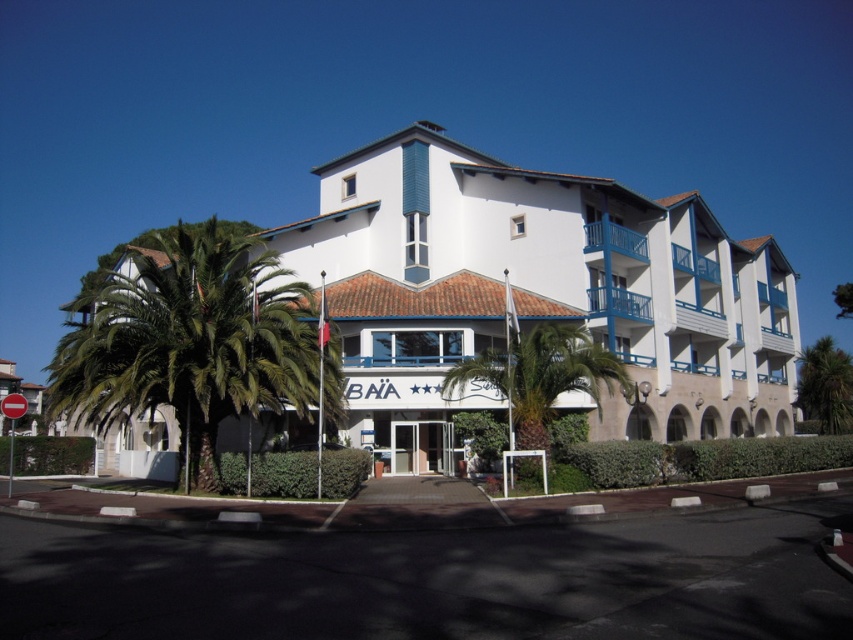
Question: Which point appears farthest from the camera in this image?

Choices:
 (A) [837, 416]
 (B) [532, 413]
 (C) [659, 417]

Answer: (A)

Question: Is green leafy palm tree at left to the left of green leafy palm tree at right from the viewer's perspective?

Choices:
 (A) no
 (B) yes

Answer: (B)

Question: Does green leafy palm tree at left appear over green leafy palm tree at center?

Choices:
 (A) no
 (B) yes

Answer: (B)

Question: Can you confirm if white matte building at center is bigger than green leafy palm tree at right?

Choices:
 (A) no
 (B) yes

Answer: (A)

Question: Which point is farther from the camera taking this photo?

Choices:
 (A) (531, 412)
 (B) (741, 337)
 (C) (820, 337)
 (D) (189, 285)

Answer: (C)

Question: Which of these objects is positioned closest to the white matte building at center?

Choices:
 (A) green leafy palm tree at left
 (B) green leafy palm tree at center
 (C) green leafy palm tree at right

Answer: (A)